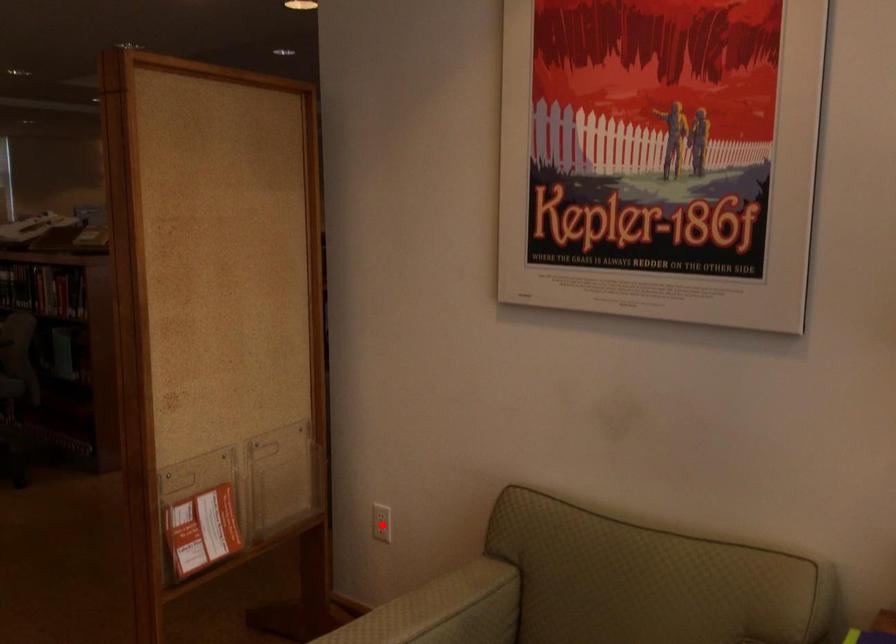
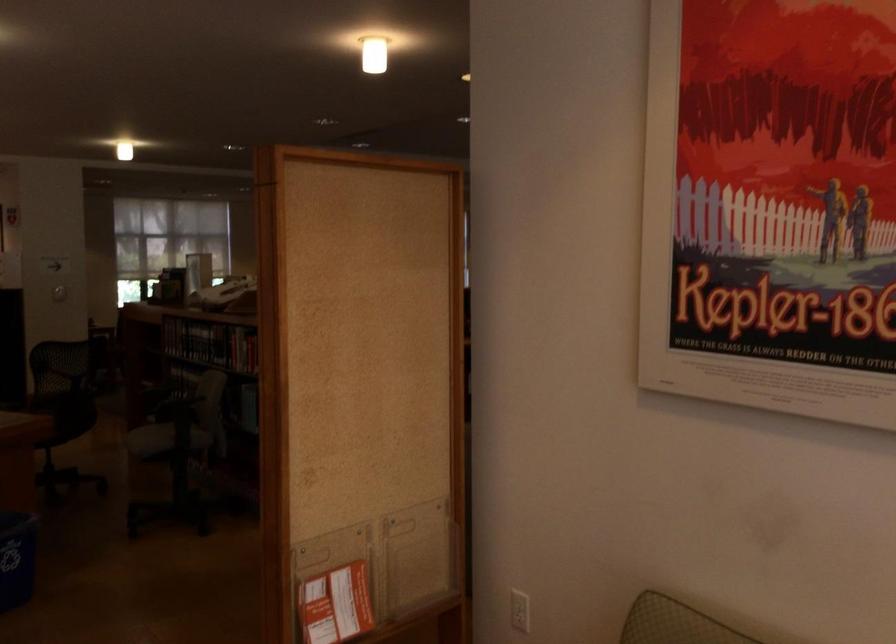
Question: I am providing you with two images of the same scene from different viewpoints. A red point is marked on the first image. At the location where the point appears in image 1, is it still visible in image 2?

Choices:
 (A) Yes
 (B) No

Answer: (A)